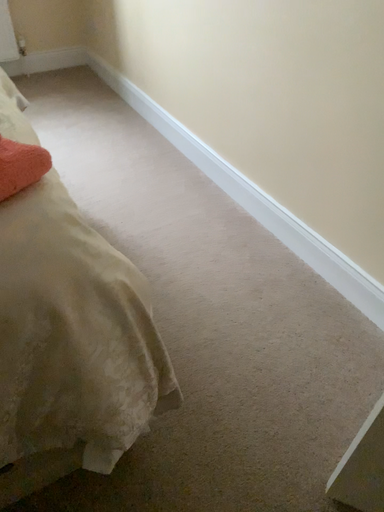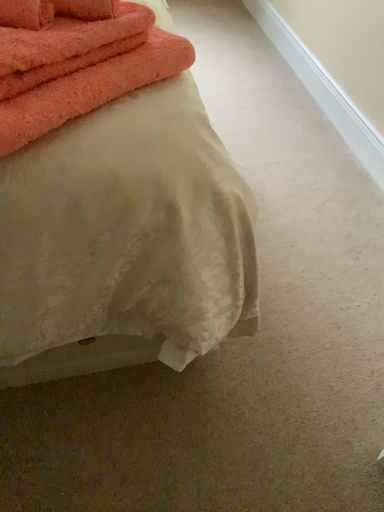
Question: How did the camera likely rotate when shooting the video?

Choices:
 (A) rotated right
 (B) rotated left

Answer: (B)